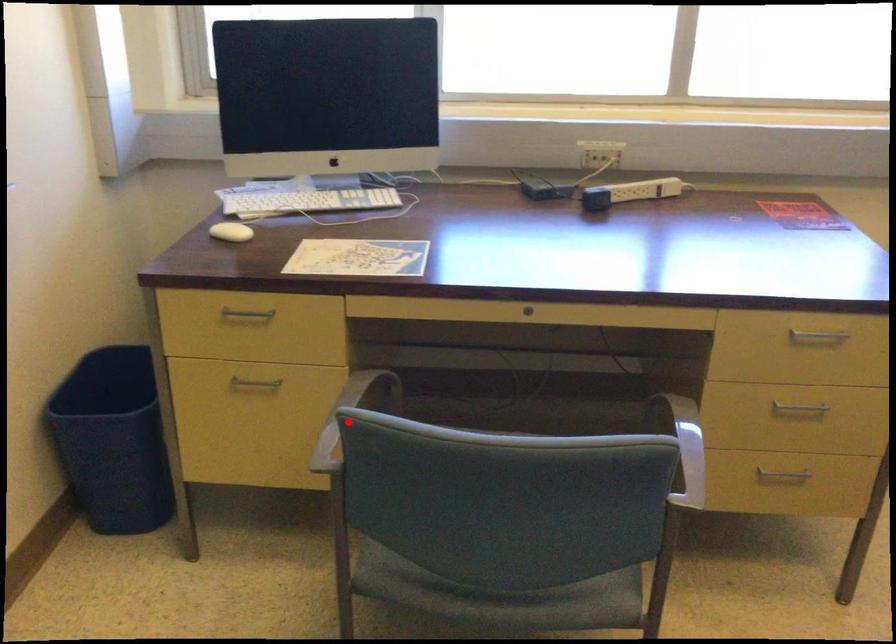
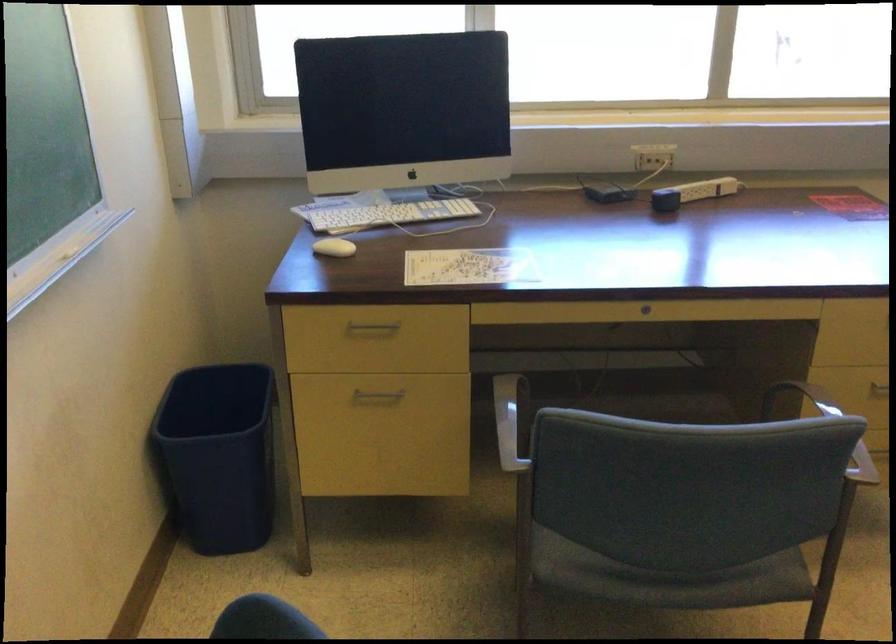
Question: I am providing you with two images of the same scene from different viewpoints. Given a red point in image1, look at the same physical point in image2. Is it:

Choices:
 (A) Closer to the viewpoint
 (B) Farther from the viewpoint

Answer: (B)